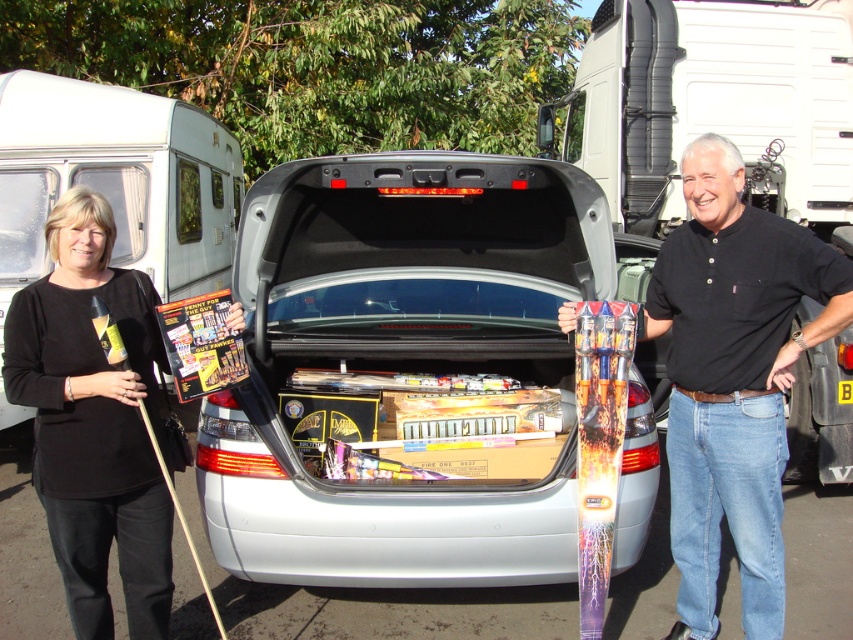
Question: Which point is closer to the camera?

Choices:
 (A) black cotton shirt at center
 (B) silver metallic car trunk at center

Answer: (A)

Question: Does silver metallic car trunk at center appear on the right side of metallic silver car trunk at center?

Choices:
 (A) yes
 (B) no

Answer: (B)

Question: Estimate the real-world distances between objects in this image. Which object is farther from the black fabric shirt at left?

Choices:
 (A) silver metallic car trunk at center
 (B) white glossy van at upper left
 (C) black cotton shirt at center

Answer: (B)

Question: Is white glossy van at upper left above metallic silver car trunk at center?

Choices:
 (A) no
 (B) yes

Answer: (B)

Question: Does black cotton shirt at center have a lesser width compared to white glossy van at upper left?

Choices:
 (A) yes
 (B) no

Answer: (A)

Question: Which is nearer to the black cotton shirt at center?

Choices:
 (A) metallic silver car trunk at center
 (B) black fabric shirt at left
 (C) white glossy van at upper left

Answer: (A)